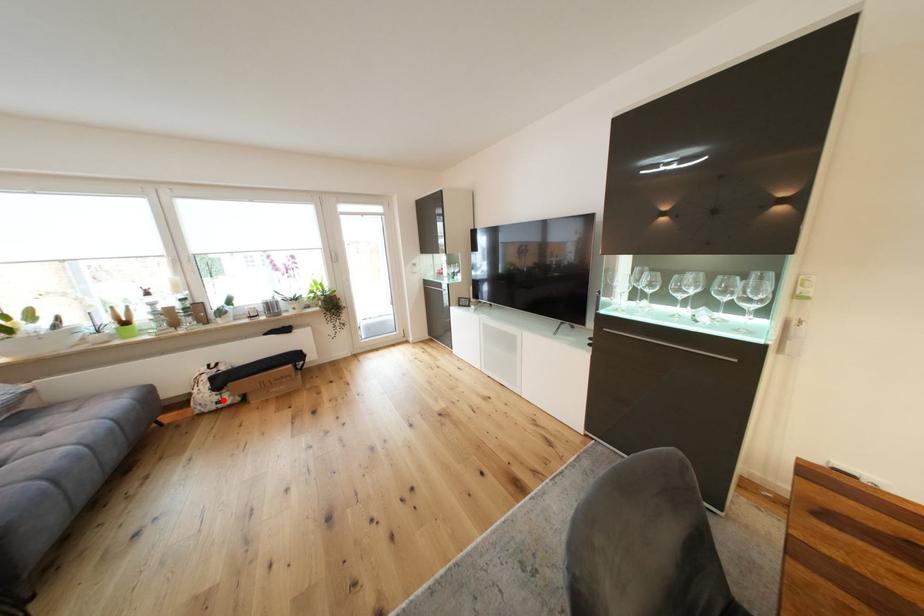
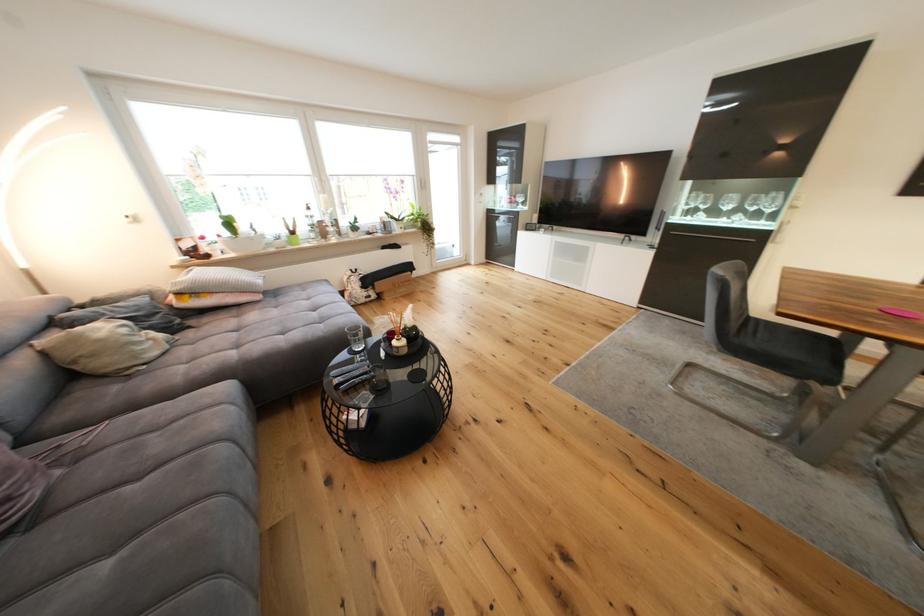
The point at the highlighted location is marked in the first image. Where is the corresponding point in the second image?

(372, 296)